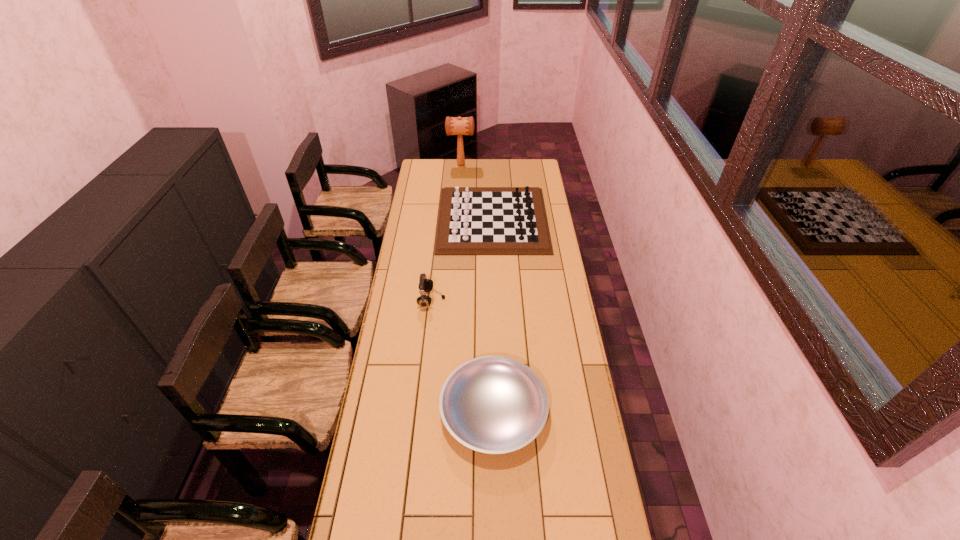
At what (x,y) coordinates should I click in order to perform the action: click on free region located 0.140m on the front of the second farthest object. Please return your answer as a coordinate pair (x, y). Image resolution: width=960 pixels, height=540 pixels. Looking at the image, I should click on (494, 275).

Where is `free location located on the back of the bedpan`? free location located on the back of the bedpan is located at coordinates (491, 302).

Where is `object present at the far edge`? This screenshot has height=540, width=960. object present at the far edge is located at coordinates (459, 126).

Where is `object that is at the left edge`? The image size is (960, 540). object that is at the left edge is located at coordinates (425, 285).

Identify the location of gameboard located in the right edge section of the desktop. pos(472,220).

Locate an element on the screen. bedpan that is positioned at the right edge is located at coordinates (492, 404).

Where is `vacant space at the left edge of the desktop`? vacant space at the left edge of the desktop is located at coordinates (374, 501).

At what (x,y) coordinates should I click in order to perform the action: click on free location at the right edge of the desktop. Please return your answer as a coordinate pair (x, y). The width and height of the screenshot is (960, 540). Looking at the image, I should click on point(532,255).

In the image, there is a desktop. At what (x,y) coordinates should I click in order to perform the action: click on free region at the far left corner. Please return your answer as a coordinate pair (x, y). Looking at the image, I should click on (420, 172).

Identify the location of vacant space at the far right corner. (522, 176).